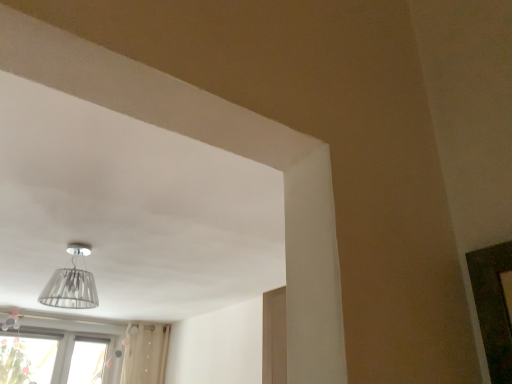
I want to click on transparent glass lampshade at upper center, so [x=71, y=284].

This screenshot has height=384, width=512. What do you see at coordinates (71, 284) in the screenshot? I see `transparent glass lampshade at upper center` at bounding box center [71, 284].

This screenshot has height=384, width=512. In order to click on transparent glass window at lower left in this screenshot , I will do `click(79, 352)`.

What do you see at coordinates (79, 352) in the screenshot? I see `transparent glass window at lower left` at bounding box center [79, 352].

Where is `transparent glass lampshade at upper center`? This screenshot has width=512, height=384. transparent glass lampshade at upper center is located at coordinates (71, 284).

Is transparent glass lampshade at upper center at the right side of transparent glass window at lower left?

Yes, transparent glass lampshade at upper center is to the right of transparent glass window at lower left.

Considering the positions of objects transparent glass lampshade at upper center and transparent glass window at lower left in the image provided, who is in front, transparent glass lampshade at upper center or transparent glass window at lower left?

transparent glass lampshade at upper center is closer to the camera.

Is point (45, 288) farther from viewer compared to point (104, 381)?

No, (45, 288) is in front of (104, 381).

From the image's perspective, which one is positioned higher, transparent glass lampshade at upper center or transparent glass window at lower left?

transparent glass lampshade at upper center.

From a real-world perspective, is transparent glass lampshade at upper center under transparent glass window at lower left?

No, from a real-world perspective, transparent glass lampshade at upper center is not beneath transparent glass window at lower left.

Which of these two, transparent glass lampshade at upper center or transparent glass window at lower left, is thinner?

transparent glass window at lower left.

Can you confirm if transparent glass lampshade at upper center is shorter than transparent glass window at lower left?

Correct, transparent glass lampshade at upper center is not as tall as transparent glass window at lower left.

Considering the sizes of transparent glass lampshade at upper center and transparent glass window at lower left in the image, is transparent glass lampshade at upper center bigger or smaller than transparent glass window at lower left?

In the image, transparent glass lampshade at upper center appears to be smaller than transparent glass window at lower left.

Is transparent glass lampshade at upper center inside or outside of transparent glass window at lower left?

transparent glass lampshade at upper center is outside transparent glass window at lower left.

Is transparent glass lampshade at upper center in contact with transparent glass window at lower left?

transparent glass lampshade at upper center and transparent glass window at lower left are clearly separated.

Is transparent glass lampshade at upper center positioned with its back to transparent glass window at lower left?

Absolutely, transparent glass lampshade at upper center is directed away from transparent glass window at lower left.

The width and height of the screenshot is (512, 384). In the image, there is a transparent glass window at lower left. What are the coordinates of `lamp above it (from the image's perspective)` in the screenshot? It's located at (71, 284).

Does transparent glass window at lower left appear on the left side of transparent glass lampshade at upper center?

Correct, you'll find transparent glass window at lower left to the left of transparent glass lampshade at upper center.

Which object is closer to the camera taking this photo, transparent glass window at lower left or transparent glass lampshade at upper center?

transparent glass lampshade at upper center is more forward.

Is point (10, 354) positioned after point (61, 307)?

That is True.

From the image's perspective, is transparent glass window at lower left beneath transparent glass lampshade at upper center?

Yes, from the image's perspective, transparent glass window at lower left is beneath transparent glass lampshade at upper center.

From a real-world perspective, which is physically above, transparent glass window at lower left or transparent glass lampshade at upper center?

In real-world perspective, transparent glass lampshade at upper center is above.

Considering the relative sizes of transparent glass window at lower left and transparent glass lampshade at upper center in the image provided, is transparent glass window at lower left wider than transparent glass lampshade at upper center?

In fact, transparent glass window at lower left might be narrower than transparent glass lampshade at upper center.

Between transparent glass window at lower left and transparent glass lampshade at upper center, which one has less height?

Standing shorter between the two is transparent glass lampshade at upper center.

Looking at this image, which of these two, transparent glass window at lower left or transparent glass lampshade at upper center, is bigger?

transparent glass window at lower left is bigger.

Would you say transparent glass window at lower left contains transparent glass lampshade at upper center?

That's incorrect, transparent glass lampshade at upper center is not inside transparent glass window at lower left.

Is there a large distance between transparent glass window at lower left and transparent glass lampshade at upper center?

Absolutely, transparent glass window at lower left is distant from transparent glass lampshade at upper center.

Is transparent glass window at lower left oriented towards transparent glass lampshade at upper center?

Yes, transparent glass window at lower left faces towards transparent glass lampshade at upper center.

You are a GUI agent. You are given a task and a screenshot of the screen. Output one action in this format:
    pyautogui.click(x=<x>, y=<y>)
    Task: Click on the window lying on the left of transparent glass lampshade at upper center
    This screenshot has height=384, width=512.
    Given the screenshot: What is the action you would take?
    pyautogui.click(x=79, y=352)

There is a transparent glass window at lower left. Identify the location of lamp above it (from a real-world perspective). The width and height of the screenshot is (512, 384). (71, 284).

Image resolution: width=512 pixels, height=384 pixels. Find the location of `window below the transparent glass lampshade at upper center (from the image's perspective)`. window below the transparent glass lampshade at upper center (from the image's perspective) is located at coordinates (79, 352).